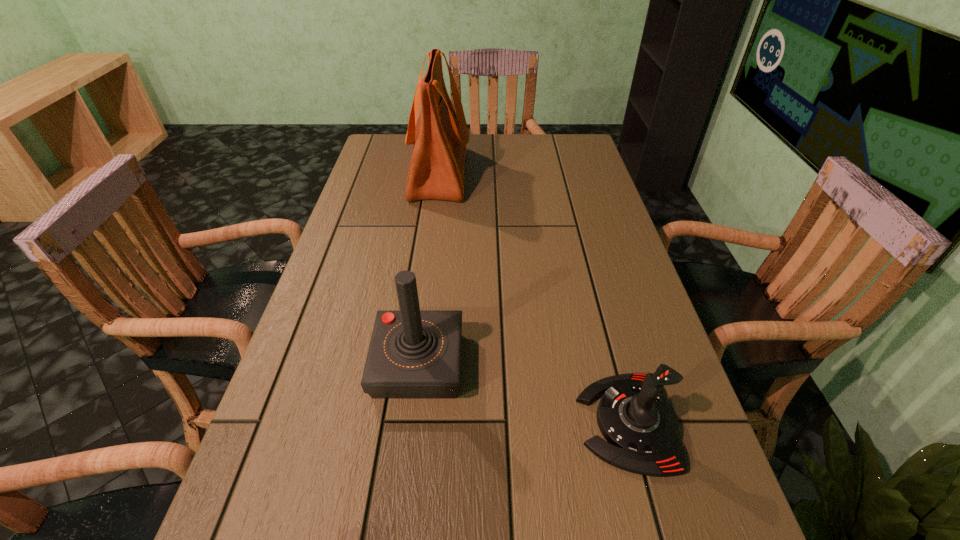
The width and height of the screenshot is (960, 540). Identify the location of free point located on the handle side of the shorter joystick. (369, 423).

At what (x,y) coordinates should I click in order to perform the action: click on object present at the far edge. Please return your answer as a coordinate pair (x, y). Looking at the image, I should click on (440, 136).

The image size is (960, 540). I want to click on object that is at the left edge, so click(440, 136).

At what (x,y) coordinates should I click in order to perform the action: click on object that is at the right edge. Please return your answer as a coordinate pair (x, y). Looking at the image, I should click on (641, 428).

Find the location of a particular element. Image resolution: width=960 pixels, height=540 pixels. object that is at the far left corner is located at coordinates (440, 136).

The height and width of the screenshot is (540, 960). Find the location of `vacant space at the far edge of the desktop`. vacant space at the far edge of the desktop is located at coordinates (528, 147).

Identify the location of vacant area at the left edge of the desktop. The height and width of the screenshot is (540, 960). (347, 346).

Identify the location of vacant area at the right edge of the desktop. The height and width of the screenshot is (540, 960). (660, 486).

Identify the location of vacant area at the far right corner of the desktop. (587, 147).

The image size is (960, 540). What are the coordinates of `vacant area that lies between the farthest object and the taller joystick` in the screenshot? It's located at tap(428, 269).